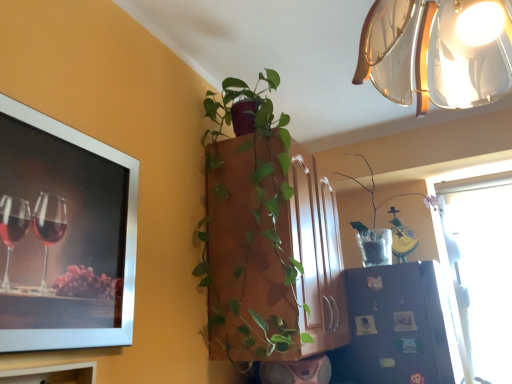
Question: Visually, is black matte refrigerator at lower right positioned to the left or to the right of translucent glass lampshade at upper right?

Choices:
 (A) left
 (B) right

Answer: (B)

Question: From a real-world perspective, is black matte refrigerator at lower right above or below translucent glass lampshade at upper right?

Choices:
 (A) above
 (B) below

Answer: (B)

Question: Which of these objects is positioned closest to the green matte plant at center, placed as the 2th houseplant when sorted from back to front?

Choices:
 (A) translucent glass vase at upper right, which is counted as the first houseplant, starting from the back
 (B) black matte refrigerator at lower right
 (C) translucent glass lampshade at upper right
 (D) silver metallic picture frame at upper left

Answer: (D)

Question: Which object is the closest to the translucent glass lampshade at upper right?

Choices:
 (A) black matte refrigerator at lower right
 (B) translucent glass vase at upper right, which ranks as the first houseplant in right-to-left order
 (C) green matte plant at center, positioned as the first houseplant in front-to-back order
 (D) silver metallic picture frame at upper left

Answer: (C)